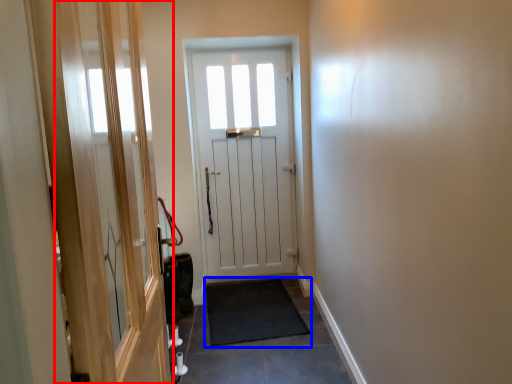
Question: Which object is further to the camera taking this photo, screen door (highlighted by a red box) or doormat (highlighted by a blue box)?

Choices:
 (A) screen door
 (B) doormat

Answer: (B)